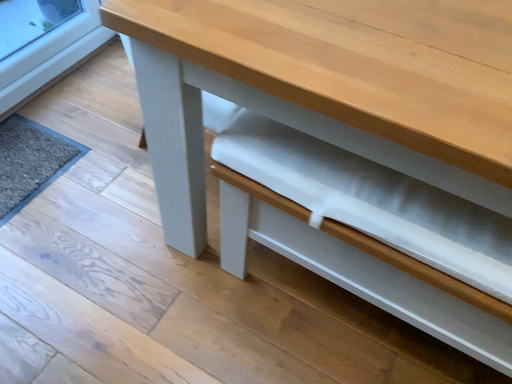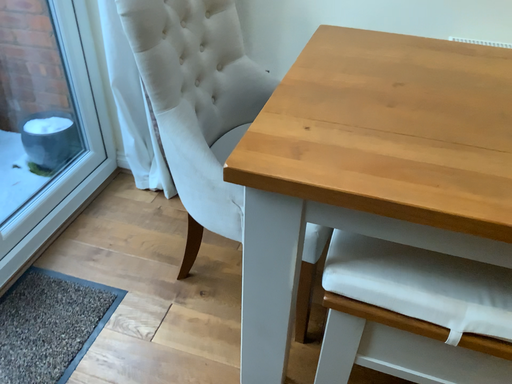
Question: How did the camera likely rotate when shooting the video?

Choices:
 (A) rotated downward
 (B) rotated upward

Answer: (B)